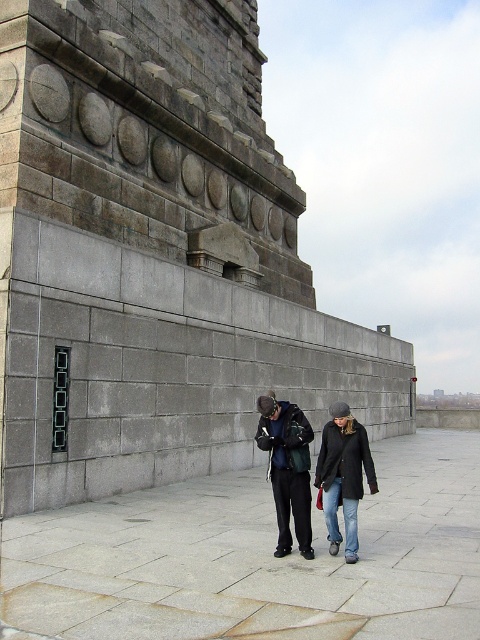
You are standing at the origin point of the coordinate system. Where is the matte black jacket at center located in terms of coordinates?

The matte black jacket at center is located at coordinates point [287,467].

You are a fashion designer observing two jackets displayed side by side at a runway show. The matte black jacket at center and the dark gray fabric jacket at center are part of the collection. Which jacket appears taller when viewed from the front?

The matte black jacket at center appears taller than the dark gray fabric jacket at center because the matte black jacket at center has a greater height compared to dark gray fabric jacket at center.